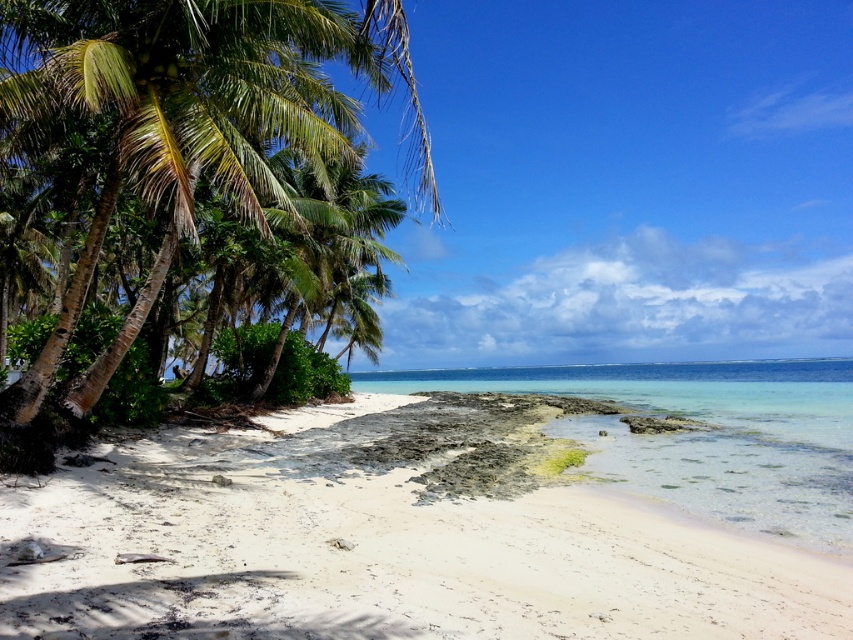
You are standing on the white sandy beach at lower left and want to reach the green leafy palm tree at left. Which direction should you walk to get closer to the palm tree?

You should walk towards the left because the green leafy palm tree at left is located to the left of the white sandy beach at lower left, so moving in that direction will bring you closer to it.

You are standing on the white sandy beach at lower left and want to walk to the clear sand at lower center. Which direction should you move to reach the wider area?

The clear sand at lower center is wider than the white sandy beach at lower left, so you should move towards the center to reach the wider area.